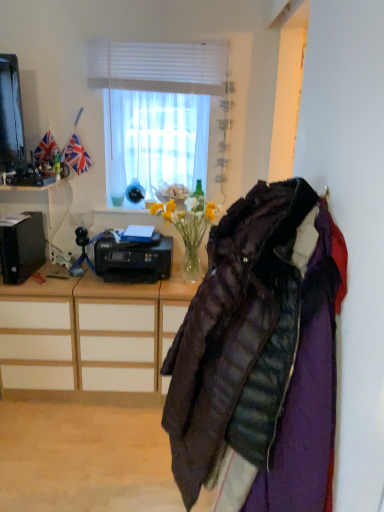
Question: Is black plastic printer at left, the 2th desk ordered from the bottom, positioned before wooden desk at left, the first desk when ordered from bottom to top?

Choices:
 (A) no
 (B) yes

Answer: (B)

Question: Does black plastic printer at left, the 2th desk ordered from the bottom, appear on the left side of wooden desk at left, the first desk when ordered from bottom to top?

Choices:
 (A) no
 (B) yes

Answer: (B)

Question: Considering the relative sizes of black plastic printer at left, the 2th desk ordered from the bottom, and wooden desk at left, the 2th desk viewed from the top, in the image provided, is black plastic printer at left, the 2th desk ordered from the bottom, thinner than wooden desk at left, the 2th desk viewed from the top,?

Choices:
 (A) yes
 (B) no

Answer: (A)

Question: From a real-world perspective, is black plastic printer at left, the 2th desk ordered from the bottom, on wooden desk at left, the first desk when ordered from bottom to top?

Choices:
 (A) no
 (B) yes

Answer: (B)

Question: Considering the relative sizes of black plastic printer at left, the 2th desk ordered from the bottom, and wooden desk at left, the 2th desk viewed from the top, in the image provided, is black plastic printer at left, the 2th desk ordered from the bottom, smaller than wooden desk at left, the 2th desk viewed from the top,?

Choices:
 (A) yes
 (B) no

Answer: (A)

Question: Can you confirm if black plastic printer at left, which ranks as the first desk in top-to-bottom order, is bigger than wooden desk at left, the first desk when ordered from bottom to top?

Choices:
 (A) yes
 (B) no

Answer: (B)

Question: Considering the relative sizes of black plastic printer at center and wooden drawer at center in the image provided, is black plastic printer at center wider than wooden drawer at center?

Choices:
 (A) yes
 (B) no

Answer: (B)

Question: Is wooden drawer at center inside black plastic printer at center?

Choices:
 (A) no
 (B) yes

Answer: (A)

Question: Considering the relative sizes of black plastic printer at center and wooden drawer at center in the image provided, is black plastic printer at center bigger than wooden drawer at center?

Choices:
 (A) yes
 (B) no

Answer: (B)

Question: Does black plastic printer at center turn towards wooden drawer at center?

Choices:
 (A) no
 (B) yes

Answer: (A)

Question: Is black plastic printer at center oriented away from wooden drawer at center?

Choices:
 (A) yes
 (B) no

Answer: (B)

Question: From a real-world perspective, is black plastic printer at center below wooden drawer at center?

Choices:
 (A) no
 (B) yes

Answer: (A)

Question: Is black plastic printer at left, which ranks as the first desk in top-to-bottom order, not inside white matte window at upper center?

Choices:
 (A) no
 (B) yes

Answer: (B)